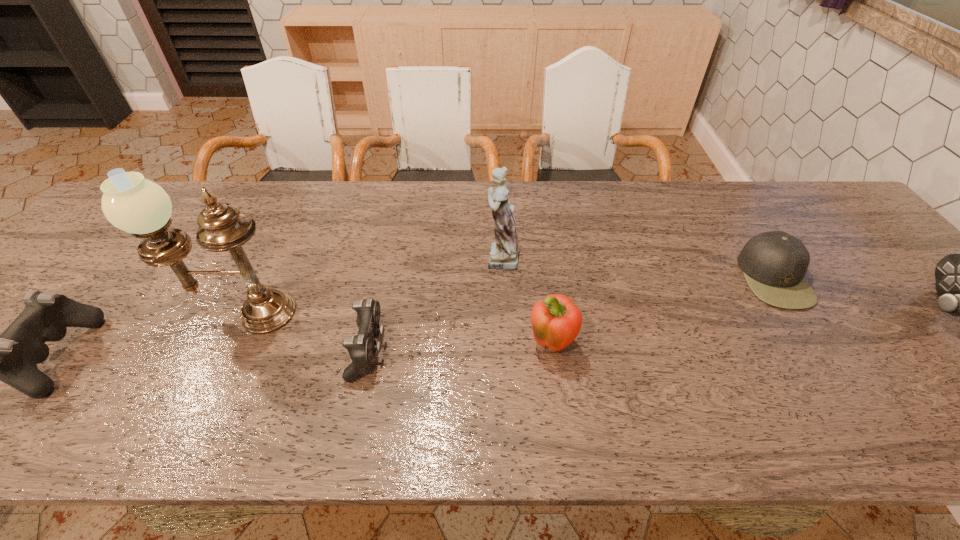
Where is `object located in the left edge section of the desktop`? This screenshot has width=960, height=540. object located in the left edge section of the desktop is located at coordinates (11, 357).

You are a GUI agent. You are given a task and a screenshot of the screen. Output one action in this format:
    pyautogui.click(x=<x>, y=<y>)
    Task: Click on the object that is positioned at the near left corner
    The height and width of the screenshot is (540, 960).
    Given the screenshot: What is the action you would take?
    pyautogui.click(x=11, y=357)

In the image, there is a desktop. Where is `blank space at the far edge`? This screenshot has width=960, height=540. blank space at the far edge is located at coordinates (759, 213).

In the image, there is a desktop. Identify the location of vacant space at the near edge. This screenshot has height=540, width=960. (250, 374).

Where is `vacant region at the left edge of the desktop`? vacant region at the left edge of the desktop is located at coordinates pyautogui.click(x=136, y=251).

The height and width of the screenshot is (540, 960). In the image, there is a desktop. What are the coordinates of `vacant space at the right edge` in the screenshot? It's located at (902, 279).

Identify the location of blank space at the far left corner. Image resolution: width=960 pixels, height=540 pixels. 176,184.

You are a GUI agent. You are given a task and a screenshot of the screen. Output one action in this format:
    pyautogui.click(x=<x>, y=<y>)
    Task: Click on the vacant space at the far right corner of the desktop
    The image size is (960, 540).
    Given the screenshot: What is the action you would take?
    pyautogui.click(x=834, y=204)

This screenshot has width=960, height=540. In the image, there is a desktop. Identify the location of free region at the near right corner. (938, 376).

Image resolution: width=960 pixels, height=540 pixels. Find the location of `vacant space in between the figurine and the fourth tallest object`. vacant space in between the figurine and the fourth tallest object is located at coordinates (525, 301).